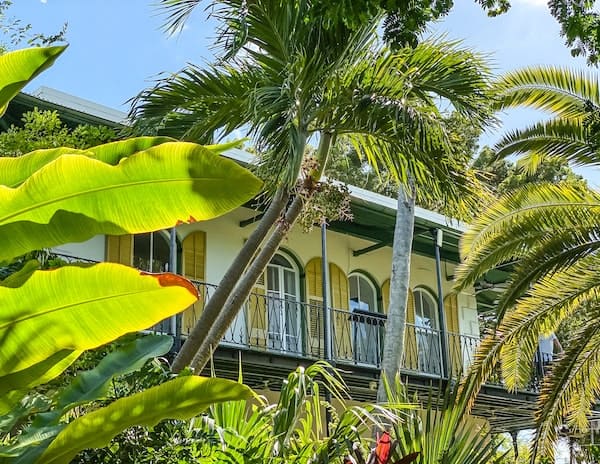
The height and width of the screenshot is (464, 600). Identify the location of shutters. (117, 254), (196, 257), (256, 289), (315, 277), (383, 289), (411, 300), (451, 314), (339, 287).